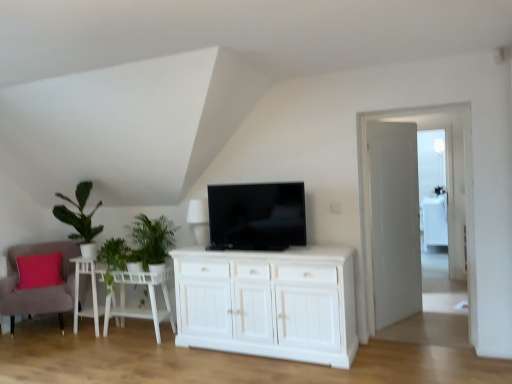
Find the location of a particular element. This screenshot has height=384, width=512. empty space that is to the right of white wooden door at right is located at coordinates (440, 317).